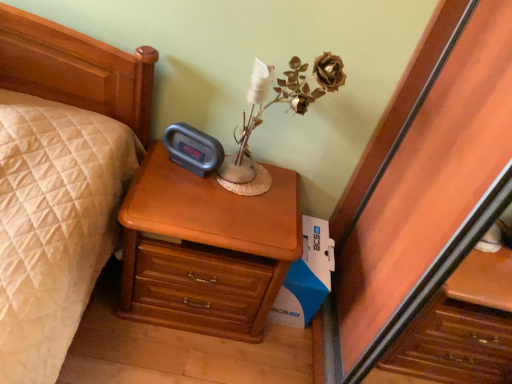
Question: Is light brown wood nightstand at center bigger or smaller than white cardboard box at lower right?

Choices:
 (A) small
 (B) big

Answer: (B)

Question: Is point click(156, 306) closer or farther from the camera than point click(324, 221)?

Choices:
 (A) farther
 (B) closer

Answer: (B)

Question: Which object is the farthest from the white cardboard box at lower right?

Choices:
 (A) light brown wood nightstand at center
 (B) brown dried flower at upper right

Answer: (B)

Question: Estimate the real-world distances between objects in this image. Which object is farther from the light brown wood nightstand at center?

Choices:
 (A) brown dried flower at upper right
 (B) white cardboard box at lower right

Answer: (A)